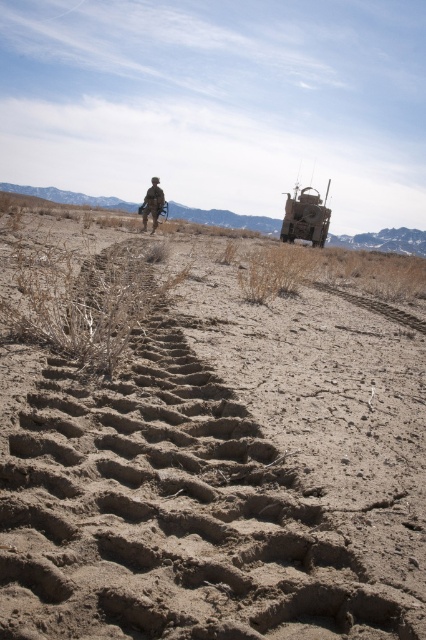
Is dull brown dirt at center above camouflage fabric military vehicle at upper center?

No.

Is dull brown dirt at center smaller than camouflage fabric military vehicle at upper center?

Yes.

This screenshot has width=426, height=640. What do you see at coordinates (218, 472) in the screenshot? I see `dull brown dirt at center` at bounding box center [218, 472].

I want to click on dull brown dirt at center, so click(218, 472).

Locate an element on the screen. The image size is (426, 640). camouflage fabric military vehicle at upper center is located at coordinates (305, 218).

Find the location of a particular element. Image resolution: width=426 pixels, height=640 pixels. camouflage fabric military vehicle at upper center is located at coordinates (305, 218).

Which of these two, dull brown dirt at center or camouflage uniform at center, stands taller?

dull brown dirt at center

Is dull brown dirt at center bigger than camouflage uniform at center?

Indeed, dull brown dirt at center has a larger size compared to camouflage uniform at center.

Is point (253, 428) closer to viewer compared to point (157, 221)?

Yes.

Find the location of a particular element. dull brown dirt at center is located at coordinates coord(218,472).